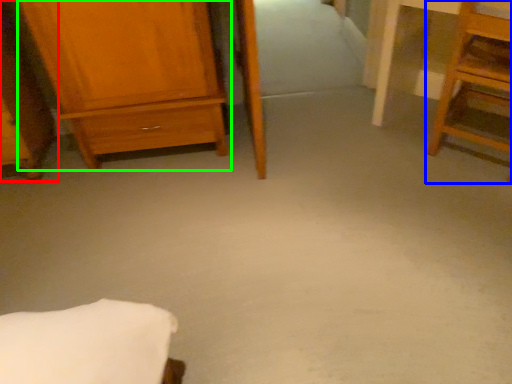
Question: Which object is positioned farthest from furniture (highlighted by a red box)? Select from furniture (highlighted by a blue box) and chest of drawers (highlighted by a green box).

Choices:
 (A) furniture
 (B) chest of drawers

Answer: (A)